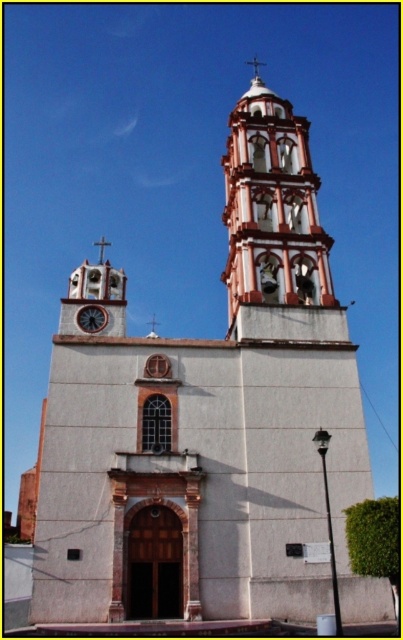
Is white painted brick tower at upper center closer to the viewer compared to white stucco spire at upper center?

Yes, it is in front of white stucco spire at upper center.

What do you see at coordinates (272, 209) in the screenshot?
I see `white painted brick tower at upper center` at bounding box center [272, 209].

Where is `white painted brick tower at upper center`? The image size is (403, 640). white painted brick tower at upper center is located at coordinates (272, 209).

Does point (274, 177) come closer to viewer compared to point (83, 314)?

No, (274, 177) is further to viewer.

Between point (270, 211) and point (91, 310), which one is positioned in front?

Point (91, 310)

Find the location of a particular element. The image size is (403, 640). white painted brick tower at upper center is located at coordinates (272, 209).

What do you see at coordinates (91, 317) in the screenshot? The height and width of the screenshot is (640, 403). I see `wooden clock at center` at bounding box center [91, 317].

Does wooden clock at center appear on the left side of white stucco spire at upper center?

Indeed, wooden clock at center is positioned on the left side of white stucco spire at upper center.

Between point (99, 314) and point (253, 60), which one is positioned behind?

Positioned behind is point (253, 60).

Find the location of a particular element. wooden clock at center is located at coordinates tap(91, 317).